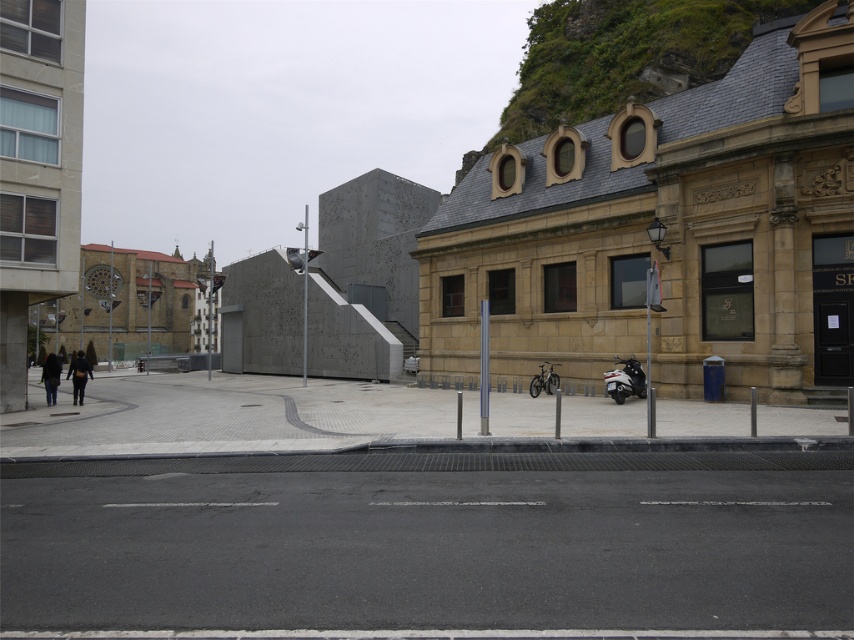
You are a delivery person who needs to park your shiny silver motorcycle at lower right and your dark gray coat at left in this quiet street scene. Given the space constraints, which item should you place first to ensure both fit comfortably?

Since the shiny silver motorcycle at lower right occupies less space than the dark gray coat at left, you should place the dark gray coat at left first to ensure there is enough space for both items.

You are standing on the urban street scene described. There are two points marked on the image at coordinates point [626,392] and point [556,387]. Which point is closer to your current position?

Point [626,392] is closer to the camera than point [556,387], so the point closer to your current position is point [626,392].